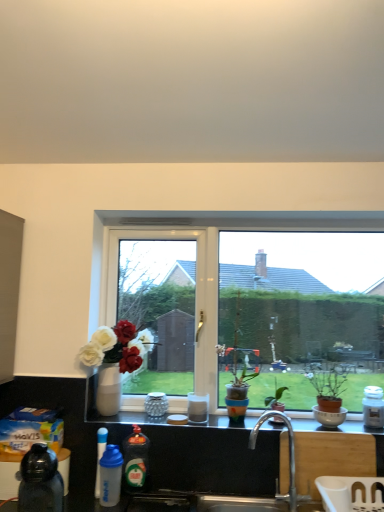
Identify the location of vacant area to the left of white ceramic bowl at window. The image size is (384, 512). (293, 429).